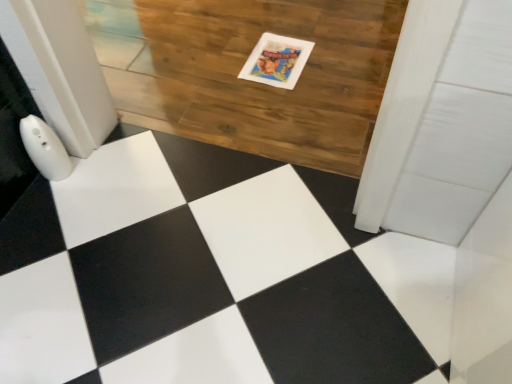
Measure the distance between matte paper postcard at upper center and camera.

matte paper postcard at upper center and camera are 4.97 feet apart from each other.

What do you see at coordinates (277, 61) in the screenshot? I see `matte paper postcard at upper center` at bounding box center [277, 61].

In order to click on matte paper postcard at upper center in this screenshot , I will do `click(277, 61)`.

Measure the distance between wooden floor at center and camera.

4.13 feet.

Measure the distance between point (267, 120) and camera.

The distance of point (267, 120) from camera is 4.65 feet.

The image size is (512, 384). What are the coordinates of `wooden floor at center` in the screenshot? It's located at (250, 81).

Describe the element at coordinates (250, 81) in the screenshot. I see `wooden floor at center` at that location.

What is the approximate width of wooden floor at center?

It is 1.08 meters.

The width and height of the screenshot is (512, 384). In order to click on matte paper postcard at upper center in this screenshot , I will do `click(277, 61)`.

Which is more to the right, matte paper postcard at upper center or wooden floor at center?

matte paper postcard at upper center is more to the right.

Which object is further away from the camera, matte paper postcard at upper center or wooden floor at center?

matte paper postcard at upper center is more distant.

Does point (267, 54) lie in front of point (141, 119)?

No, (267, 54) is behind (141, 119).

From the image's perspective, which is below, matte paper postcard at upper center or wooden floor at center?

matte paper postcard at upper center appears lower in the image.

From a real-world perspective, who is located lower, matte paper postcard at upper center or wooden floor at center?

From a 3D spatial view, wooden floor at center is below.

Which object is wider, matte paper postcard at upper center or wooden floor at center?

wooden floor at center.

Considering the sizes of objects matte paper postcard at upper center and wooden floor at center in the image provided, who is taller, matte paper postcard at upper center or wooden floor at center?

With more height is wooden floor at center.

Who is bigger, matte paper postcard at upper center or wooden floor at center?

wooden floor at center is bigger.

Is matte paper postcard at upper center outside of wooden floor at center?

→ No, most part of matte paper postcard at upper center lies within wooden floor at center.

Are matte paper postcard at upper center and wooden floor at center making contact?

→ matte paper postcard at upper center and wooden floor at center are clearly separated.

Does matte paper postcard at upper center turn towards wooden floor at center?

Yes.

How many degrees apart are the facing directions of matte paper postcard at upper center and wooden floor at center?

The angular difference between matte paper postcard at upper center and wooden floor at center is 4.29e-05 degrees.

Locate an element on the screen. hardwood that is on the left side of matte paper postcard at upper center is located at coordinates (250, 81).

Is wooden floor at center to the right of matte paper postcard at upper center from the viewer's perspective?

No.

From the picture: Does wooden floor at center lie in front of matte paper postcard at upper center?

Yes, it is.

Between point (285, 114) and point (258, 68), which one is positioned in front?

The point (285, 114) is closer to the camera.

From the image's perspective, is wooden floor at center located above or below matte paper postcard at upper center?

wooden floor at center is situated higher than matte paper postcard at upper center in the image.

From a real-world perspective, is wooden floor at center above or below matte paper postcard at upper center?

In terms of real-world spatial position, wooden floor at center is below matte paper postcard at upper center.

Which of these two, wooden floor at center or matte paper postcard at upper center, is wider?

wooden floor at center.

Consider the image. Which of these two, wooden floor at center or matte paper postcard at upper center, stands taller?

wooden floor at center is taller.

Looking at this image, considering the sizes of wooden floor at center and matte paper postcard at upper center in the image, is wooden floor at center bigger or smaller than matte paper postcard at upper center?

Considering their sizes, wooden floor at center takes up more space than matte paper postcard at upper center.

Choose the correct answer: Is wooden floor at center inside matte paper postcard at upper center or outside it?

wooden floor at center cannot be found inside matte paper postcard at upper center.

Would you consider wooden floor at center to be distant from matte paper postcard at upper center?

No, wooden floor at center is not far from matte paper postcard at upper center.

Could you tell me if wooden floor at center is turned towards matte paper postcard at upper center?

Yes, wooden floor at center is turned towards matte paper postcard at upper center.

Can you tell me how much wooden floor at center and matte paper postcard at upper center differ in facing direction?

The facing directions of wooden floor at center and matte paper postcard at upper center are 4.29e-05 degrees apart.

How far apart are wooden floor at center and matte paper postcard at upper center?

wooden floor at center is 8.72 inches away from matte paper postcard at upper center.

At what (x,y) coordinates should I click in order to perform the action: click on hardwood in front of the matte paper postcard at upper center. Please return your answer as a coordinate pair (x, y). The height and width of the screenshot is (384, 512). Looking at the image, I should click on (250, 81).

Locate an element on the screen. This screenshot has width=512, height=384. postcard that is below the wooden floor at center (from the image's perspective) is located at coordinates (277, 61).

There is a wooden floor at center. At what (x,y) coordinates should I click in order to perform the action: click on postcard above it (from a real-world perspective). Please return your answer as a coordinate pair (x, y). This screenshot has height=384, width=512. Looking at the image, I should click on (277, 61).